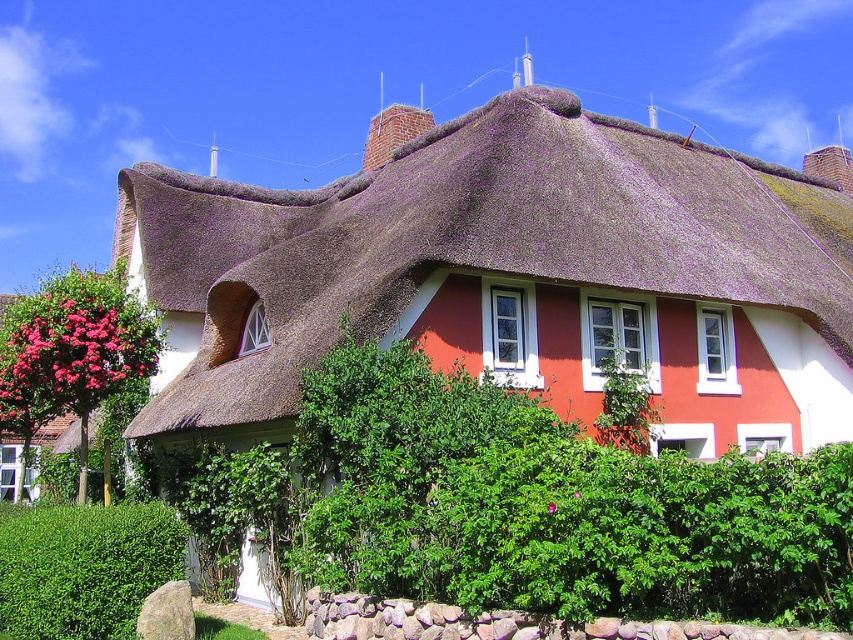
Between green leafy hedge at lower left and pink matte flowers at left, which one is positioned higher?

pink matte flowers at left

Which is below, green leafy hedge at lower left or pink matte flowers at left?

green leafy hedge at lower left

Image resolution: width=853 pixels, height=640 pixels. Describe the element at coordinates (84, 566) in the screenshot. I see `green leafy hedge at lower left` at that location.

Find the location of a particular element. The height and width of the screenshot is (640, 853). green leafy hedge at lower left is located at coordinates (84, 566).

Can you confirm if thatched brown roof at upper center is positioned above pink matte flowers at left?

Correct, thatched brown roof at upper center is located above pink matte flowers at left.

Which is in front, point (358, 230) or point (78, 376)?

Positioned in front is point (78, 376).

Locate an element on the screen. The height and width of the screenshot is (640, 853). thatched brown roof at upper center is located at coordinates (509, 220).

How much distance is there between thatched brown roof at upper center and pink matte flower at center?

thatched brown roof at upper center is 37.88 meters away from pink matte flower at center.

Where is `thatched brown roof at upper center`? This screenshot has height=640, width=853. thatched brown roof at upper center is located at coordinates [x=509, y=220].